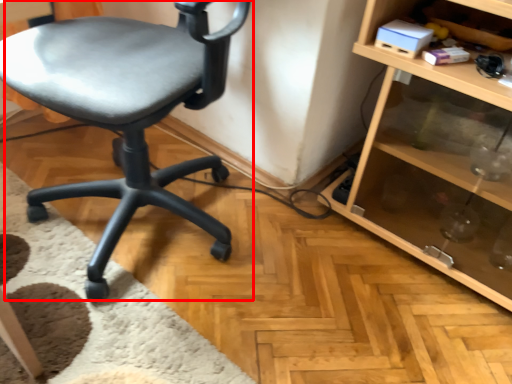
Question: From the image's perspective, where is chair (annotated by the red box) located relative to shelf?

Choices:
 (A) below
 (B) above

Answer: (B)